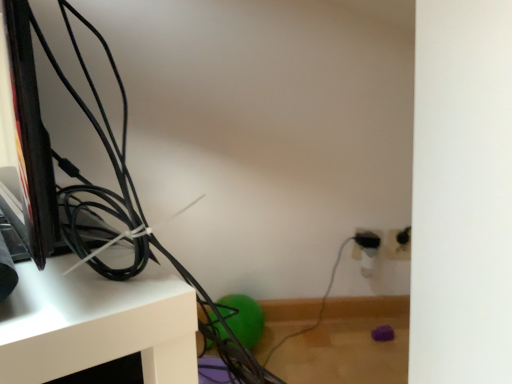
Question: Is black plastic electric outlet at right, placed as the first electric outlet when sorted from left to right, to the left or to the right of white plastic electric outlet at lower right, the 1th electric outlet in the right-to-left sequence, in the image?

Choices:
 (A) left
 (B) right

Answer: (A)

Question: Does point (358, 231) appear closer or farther from the camera than point (387, 251)?

Choices:
 (A) closer
 (B) farther

Answer: (A)

Question: Which object is the farthest from the black plastic electric outlet at right, placed as the first electric outlet when sorted from left to right?

Choices:
 (A) white glossy shelf at upper left
 (B) white plastic electric outlet at lower right, the 1th electric outlet in the right-to-left sequence

Answer: (A)

Question: Estimate the real-world distances between objects in this image. Which object is closer to the black plastic electric outlet at right, marked as the second electric outlet in a right-to-left arrangement?

Choices:
 (A) white glossy shelf at upper left
 (B) white plastic electric outlet at lower right, the 1th electric outlet in the right-to-left sequence

Answer: (B)